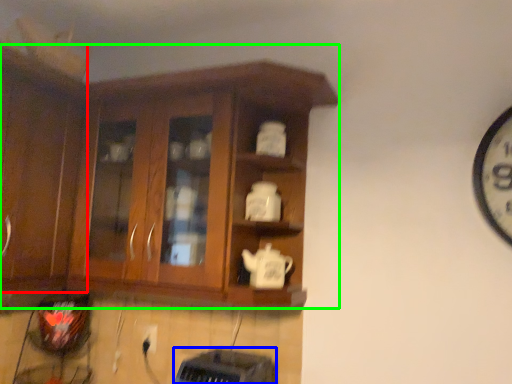
Question: Which object is positioned farthest from cabinetry (highlighted by a red box)? Select from appliance (highlighted by a blue box) and cabinetry (highlighted by a green box).

Choices:
 (A) appliance
 (B) cabinetry

Answer: (A)